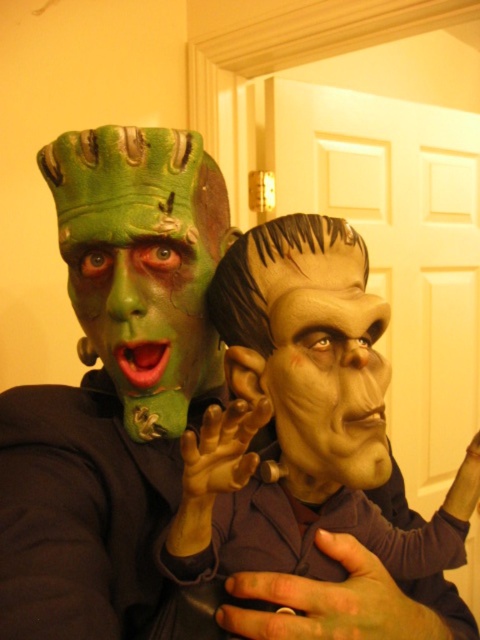
Can you confirm if green matte frankenstein mask at left is positioned below green matte frankenstein mask at center?

Actually, green matte frankenstein mask at left is above green matte frankenstein mask at center.

This screenshot has width=480, height=640. What do you see at coordinates (147, 304) in the screenshot? I see `green matte frankenstein mask at left` at bounding box center [147, 304].

This screenshot has width=480, height=640. What are the coordinates of `green matte frankenstein mask at left` in the screenshot? It's located at (147, 304).

Find the location of `green matte frankenstein mask at left`. green matte frankenstein mask at left is located at coordinates (147, 304).